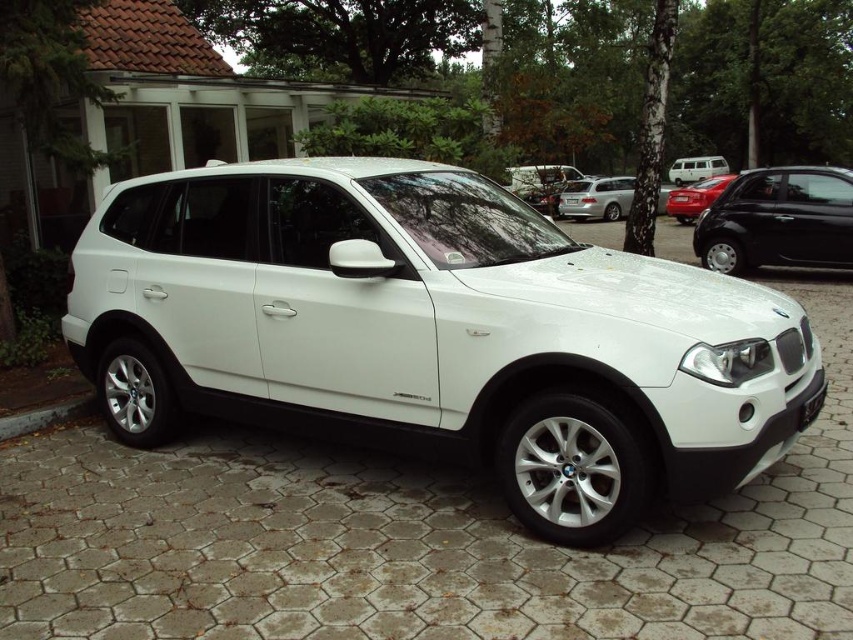
Question: Estimate the real-world distances between objects in this image. Which object is closer to the shiny red car at center?

Choices:
 (A) white plastic license plate at center
 (B) shiny black car at right

Answer: (B)

Question: Among these objects, which one is farthest from the camera?

Choices:
 (A) shiny black car at right
 (B) white matte van at upper center

Answer: (B)

Question: Which object is closer to the camera taking this photo?

Choices:
 (A) white metallic suv at center
 (B) shiny red car at center
 (C) white matte van at upper center

Answer: (A)

Question: Does shiny black car at right appear on the left side of shiny red car at center?

Choices:
 (A) yes
 (B) no

Answer: (A)

Question: Does satin silver sedan at center have a larger size compared to white matte van at upper center?

Choices:
 (A) no
 (B) yes

Answer: (A)

Question: Is white metallic suv at center bigger than shiny black car at right?

Choices:
 (A) no
 (B) yes

Answer: (B)